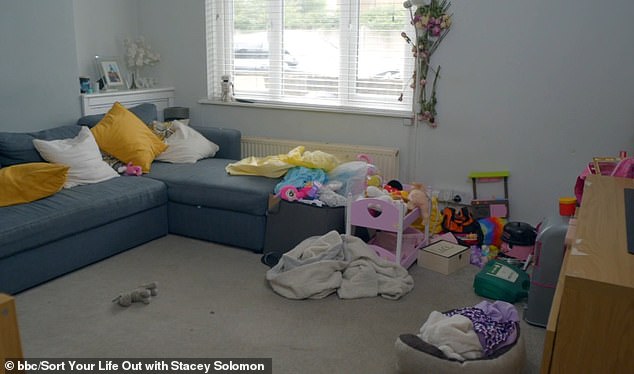
This screenshot has height=374, width=634. What are the coordinates of `wooden dresser` in the screenshot? It's located at (598, 199), (595, 273), (555, 307).